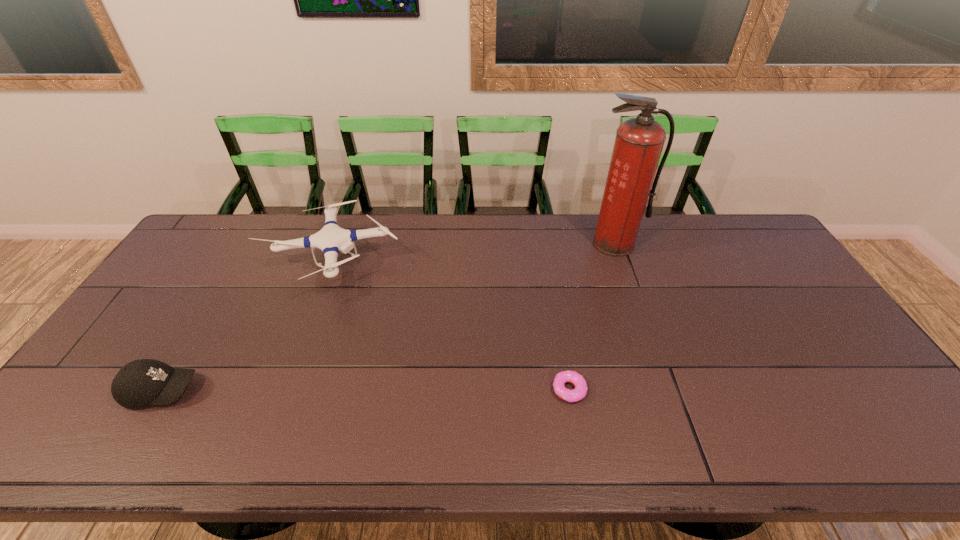
Choose which object is the second nearest neighbor to the rightmost object. Please provide its 2D coordinates. Your answer should be formatted as a tuple, i.e. [(x, y)], where the tuple contains the x and y coordinates of a point satisfying the conditions above.

[(331, 239)]

What are the coordinates of `free space that satisfies the following two spatial constraints: 1. on the front side of the second tallest object; 2. on the front-facing side of the third tallest object` in the screenshot? It's located at (285, 390).

What are the coordinates of `free location that satisfies the following two spatial constraints: 1. at the nozzle of the rightmost object; 2. on the front-facing side of the baseball cap` in the screenshot? It's located at (666, 390).

Locate an element on the screen. The width and height of the screenshot is (960, 540). free region that satisfies the following two spatial constraints: 1. at the nozzle of the tallest object; 2. on the front-facing side of the second shortest object is located at coordinates 666,390.